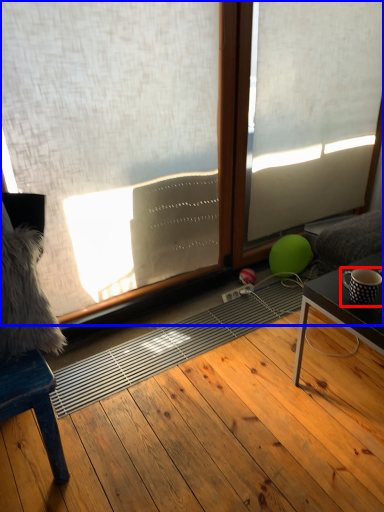
Question: Which object appears farthest to the camera in this image, coffee cup (highlighted by a red box) or window (highlighted by a blue box)?

Choices:
 (A) coffee cup
 (B) window

Answer: (A)